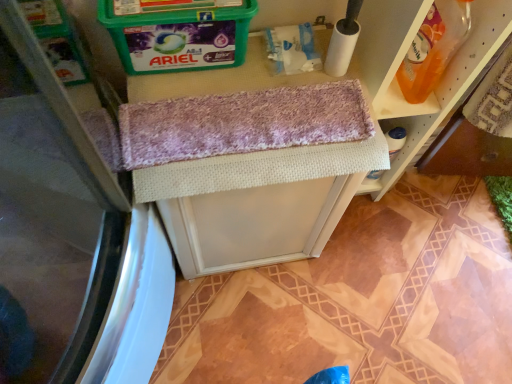
Question: Is woven fabric vanity at center wider or thinner than translucent orange bottle at upper right?

Choices:
 (A) thin
 (B) wide

Answer: (B)

Question: Does point (251, 79) appear closer or farther from the camera than point (423, 96)?

Choices:
 (A) closer
 (B) farther

Answer: (A)

Question: From a real-world perspective, is woven fabric vanity at center physically located above or below translucent orange bottle at upper right?

Choices:
 (A) below
 (B) above

Answer: (A)

Question: Considering the positions of translucent orange bottle at upper right and woven fabric vanity at center in the image, is translucent orange bottle at upper right taller or shorter than woven fabric vanity at center?

Choices:
 (A) short
 (B) tall

Answer: (A)

Question: In the image, is translucent orange bottle at upper right positioned in front of or behind woven fabric vanity at center?

Choices:
 (A) front
 (B) behind

Answer: (A)

Question: Does point (415, 64) appear closer or farther from the camera than point (296, 231)?

Choices:
 (A) closer
 (B) farther

Answer: (A)

Question: Is translucent orange bottle at upper right bigger or smaller than woven fabric vanity at center?

Choices:
 (A) small
 (B) big

Answer: (A)